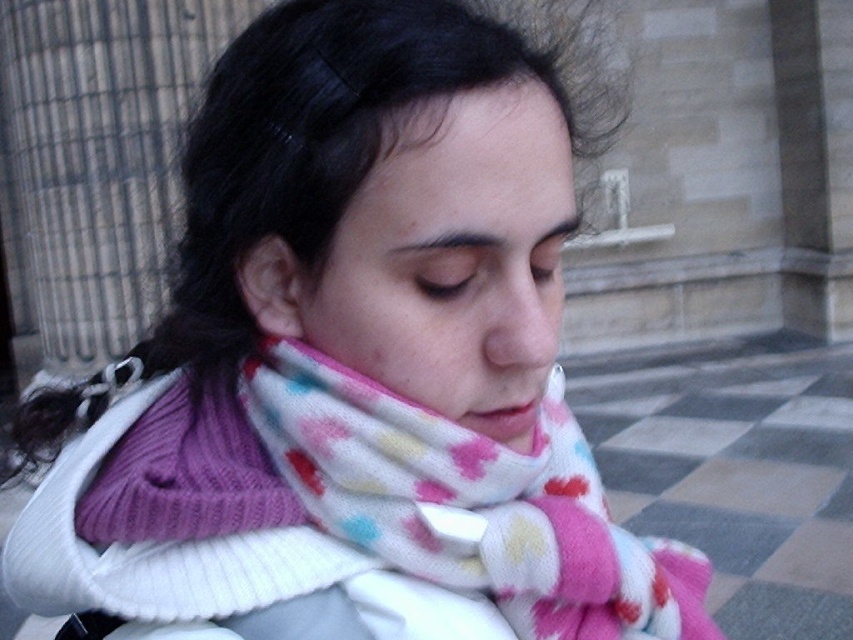
You are a photographer trying to capture both the fluffy multicolored scarf at center and the matte pink scarf at center in a single shot. Which scarf will appear closer to the camera in the photo?

The fluffy multicolored scarf at center will appear closer to the camera because it is positioned further to the viewer than the matte pink scarf at center.

You are trying to decide which scarf to wear for a walk in the evening. You see both the fluffy multicolored scarf at center and the matte pink scarf at center. Which one is taller?

The fluffy multicolored scarf at center is taller than the matte pink scarf at center.